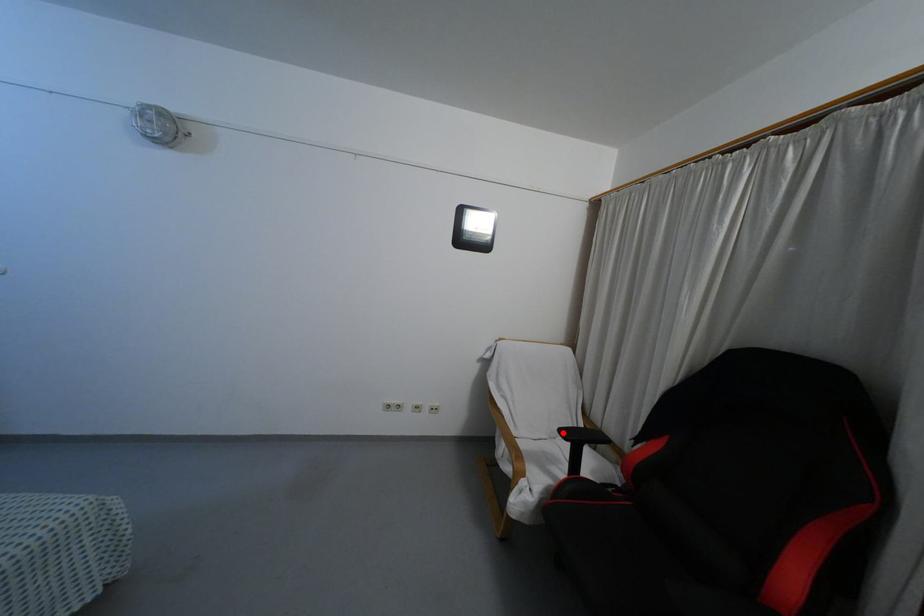
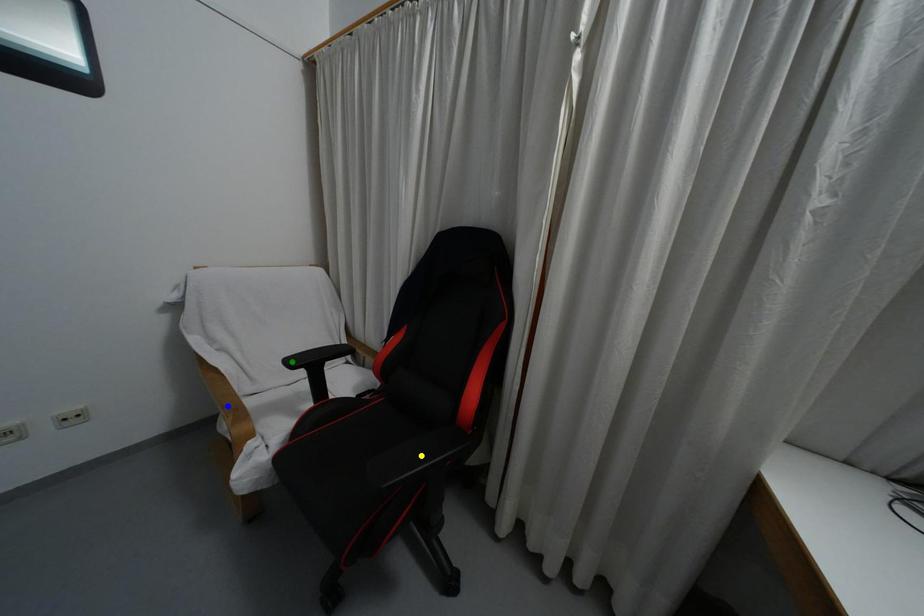
Question: I am providing you with two images of the same scene from different viewpoints. A red point is marked on the first image. You are given multiple points on the second image. Which point in image 2 represents the same 3d spot as the red point in image 1?

Choices:
 (A) blue point
 (B) green point
 (C) yellow point

Answer: (B)